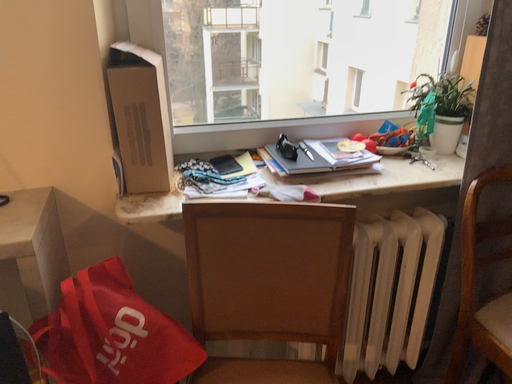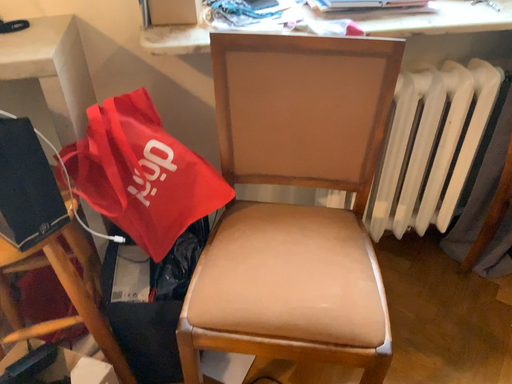
Question: How did the camera likely rotate when shooting the video?

Choices:
 (A) rotated downward
 (B) rotated upward

Answer: (A)